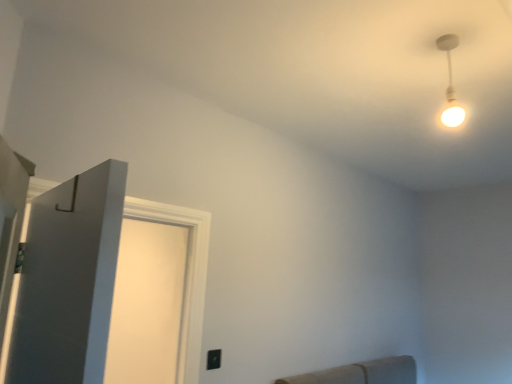
Measure the distance between point (437,42) and camera.

The depth of point (437,42) is 1.60 meters.

Image resolution: width=512 pixels, height=384 pixels. What do you see at coordinates (450, 84) in the screenshot?
I see `white glossy light bulb at upper right` at bounding box center [450, 84].

At what (x,y) coordinates should I click in order to perform the action: click on white glossy light bulb at upper right. Please return your answer as a coordinate pair (x, y). Looking at the image, I should click on (450, 84).

Measure the distance between white glossy light bulb at upper right and camera.

A distance of 5.09 feet exists between white glossy light bulb at upper right and camera.

The height and width of the screenshot is (384, 512). In order to click on white glossy light bulb at upper right in this screenshot , I will do `click(450, 84)`.